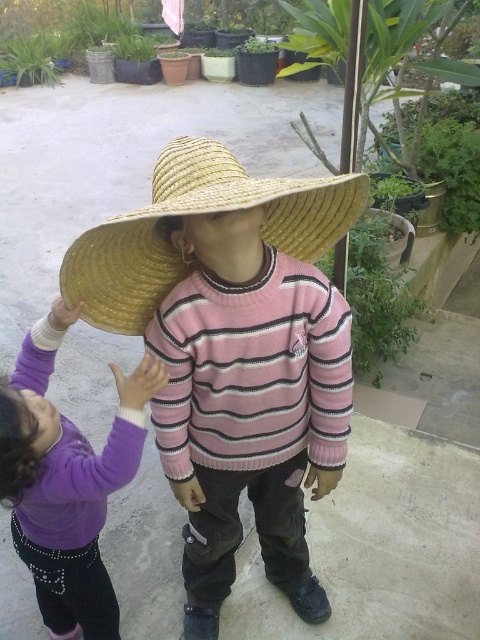
Between point (35, 540) and point (136, 288), which one is positioned in front?

Point (136, 288) is more forward.

Does purple fleece sweater at center appear over straw hat at center?

Actually, purple fleece sweater at center is below straw hat at center.

What do you see at coordinates (67, 481) in the screenshot? I see `purple fleece sweater at center` at bounding box center [67, 481].

Identify the location of purple fleece sweater at center. The height and width of the screenshot is (640, 480). (67, 481).